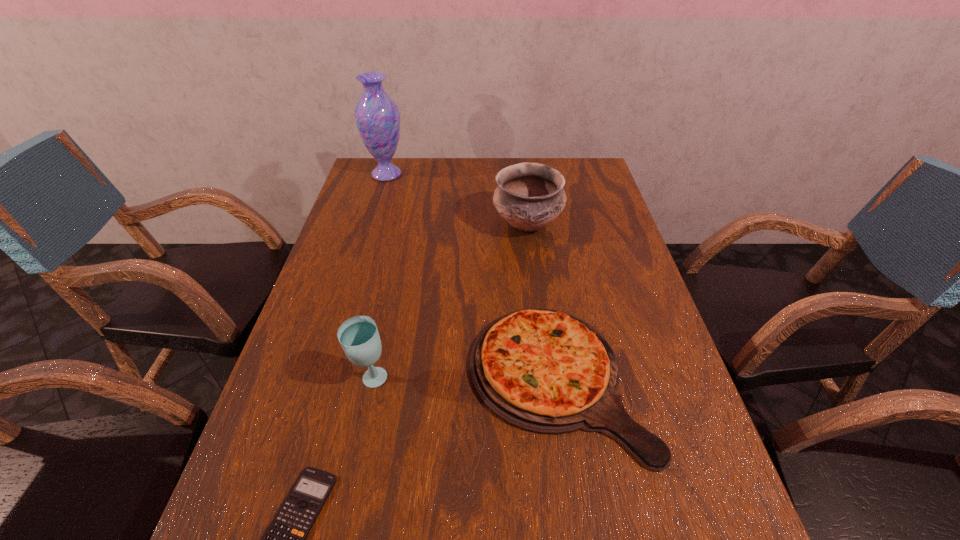
Where is `the tallest object`? The height and width of the screenshot is (540, 960). the tallest object is located at coordinates (377, 116).

The width and height of the screenshot is (960, 540). Identify the location of vase. (377, 116).

Where is `glass`? This screenshot has height=540, width=960. glass is located at coordinates (359, 337).

Where is `pottery`? pottery is located at coordinates tap(529, 196).

In order to click on the fourth tallest object in this screenshot , I will do `click(545, 371)`.

You are a GUI agent. You are given a task and a screenshot of the screen. Output one action in this format:
    pyautogui.click(x=<x>, y=<y>)
    Task: Click on the vacant space located on the front of the tallest object
    This screenshot has height=540, width=960.
    Given the screenshot: What is the action you would take?
    pyautogui.click(x=369, y=235)

The image size is (960, 540). In order to click on blank space located on the right of the glass in this screenshot , I will do `click(524, 379)`.

The image size is (960, 540). What are the coordinates of `vacant space located 0.280m on the back of the second farthest object` in the screenshot? It's located at (519, 163).

What are the coordinates of `vacant space located on the left of the pizza` in the screenshot? It's located at (282, 380).

Locate an element on the screen. The width and height of the screenshot is (960, 540). object positioned at the far edge is located at coordinates (377, 116).